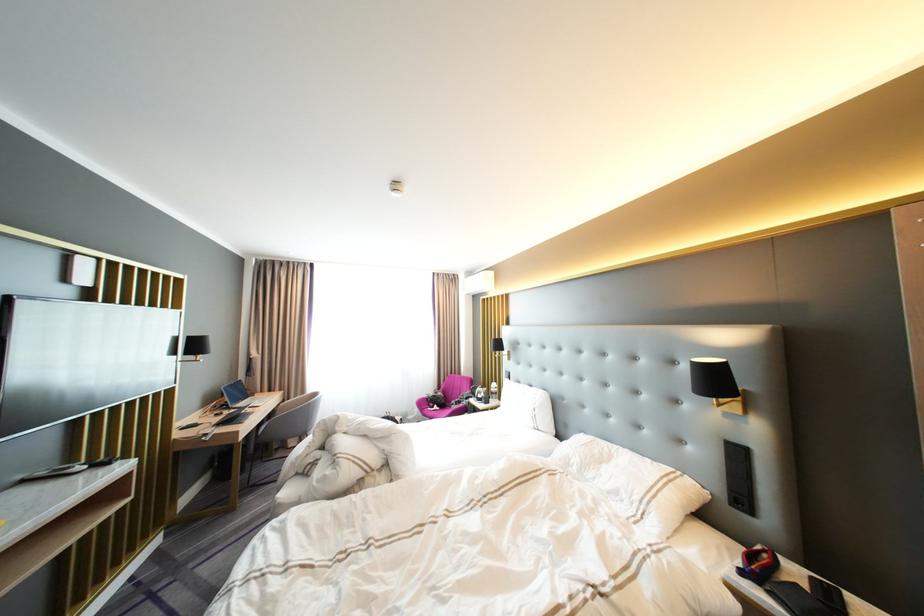
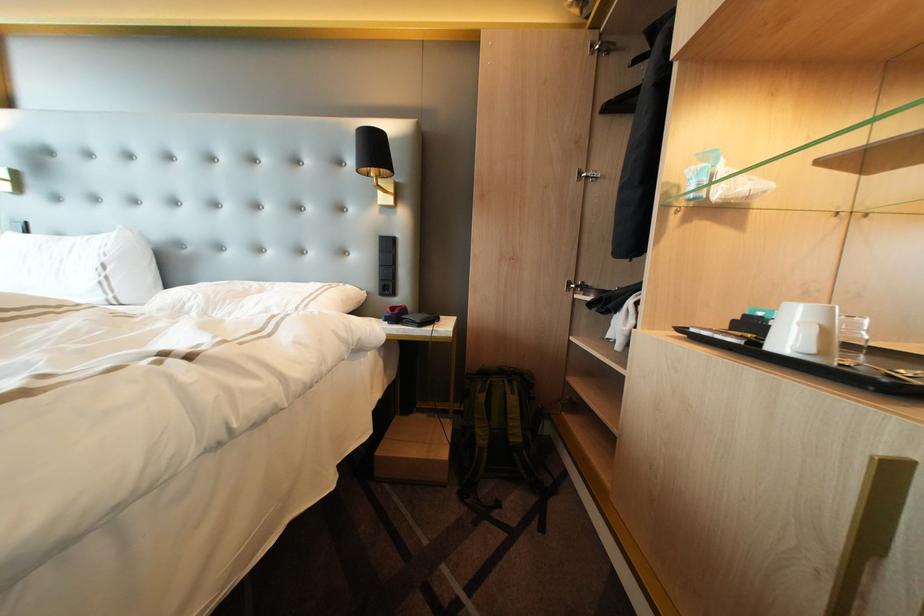
Question: The camera is either moving clockwise (left) or counter-clockwise (right) around the object. The first image is from the beginning of the video and the second image is from the end. Is the camera moving left or right when shooting the video?

Choices:
 (A) Left
 (B) Right

Answer: (A)